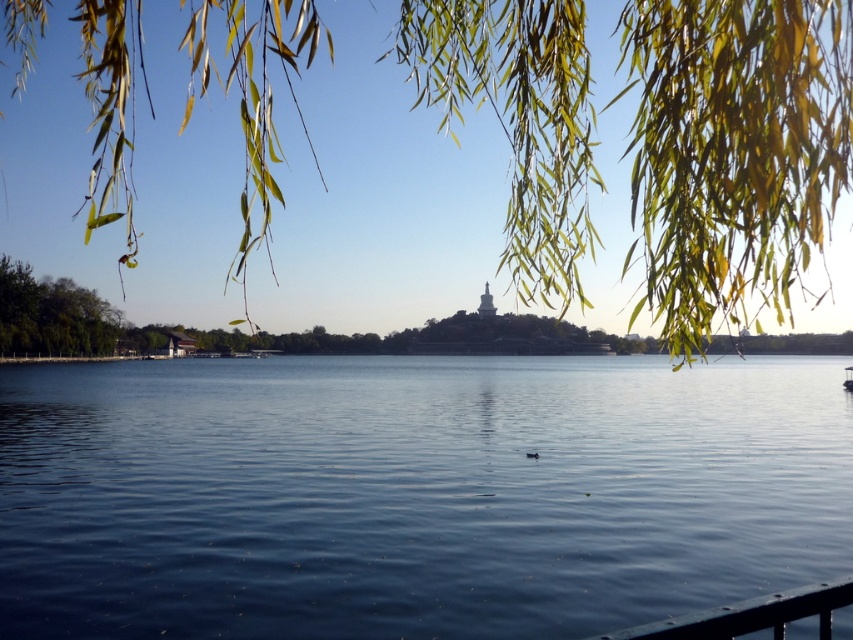
Between black metal rail at lower right and white plastic boat at center, which one has more height?

With more height is white plastic boat at center.

Where is `black metal rail at lower right`? The width and height of the screenshot is (853, 640). black metal rail at lower right is located at coordinates (749, 616).

Who is shorter, blue water at center or white plastic boat at center?

white plastic boat at center is shorter.

Is point (381, 461) in front of point (846, 372)?

Yes, it is.

Locate an element on the screen. blue water at center is located at coordinates (413, 493).

Between point (39, 428) and point (1, 13), which one is positioned behind?

The point (1, 13) is behind.

Can you confirm if blue water at center is taller than green leafy willow at upper center?

In fact, blue water at center may be shorter than green leafy willow at upper center.

Who is more forward, (648, 410) or (115, 211)?

Point (115, 211) is more forward.

Where is `blue water at center`? This screenshot has height=640, width=853. blue water at center is located at coordinates (413, 493).